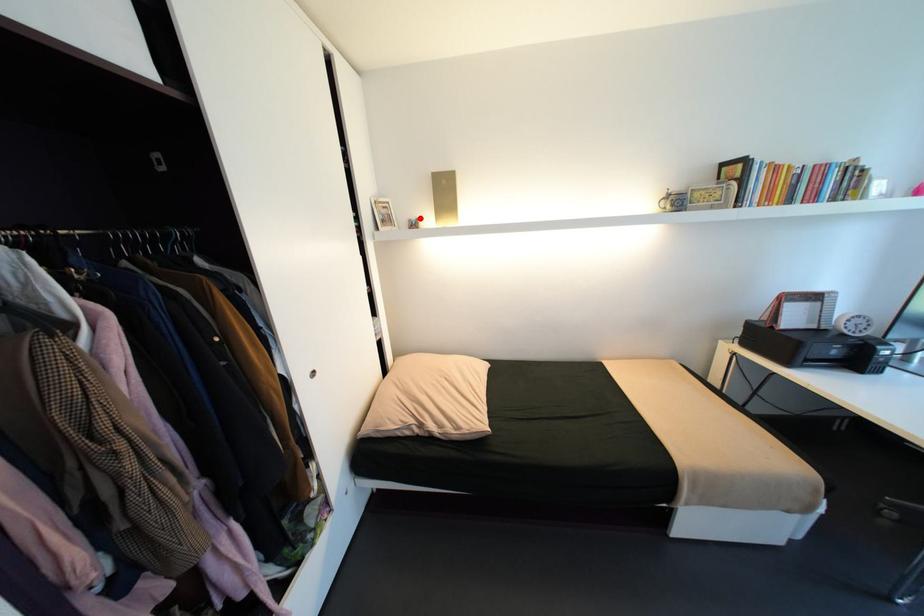
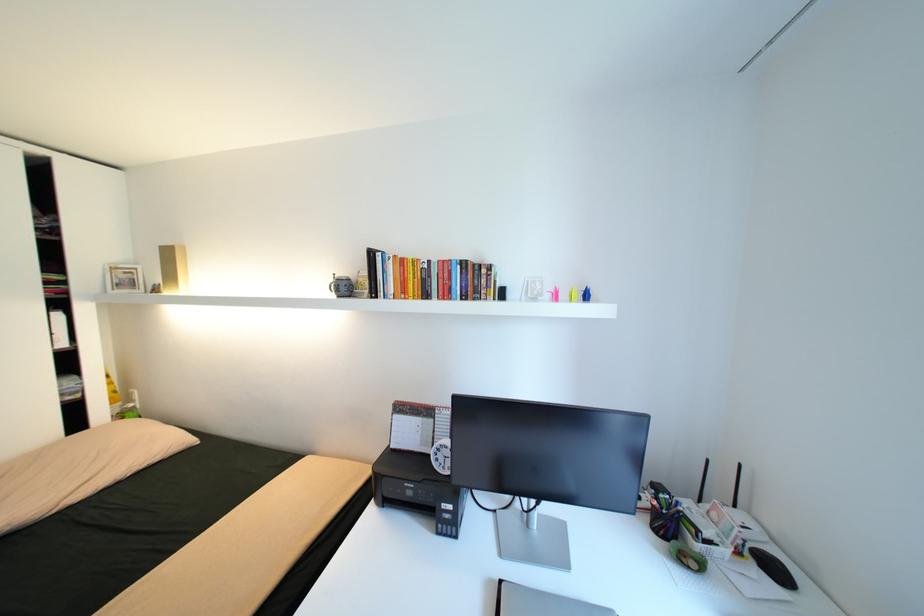
The point at the highlighted location is marked in the first image. Where is the corresponding point in the second image?

(164, 284)